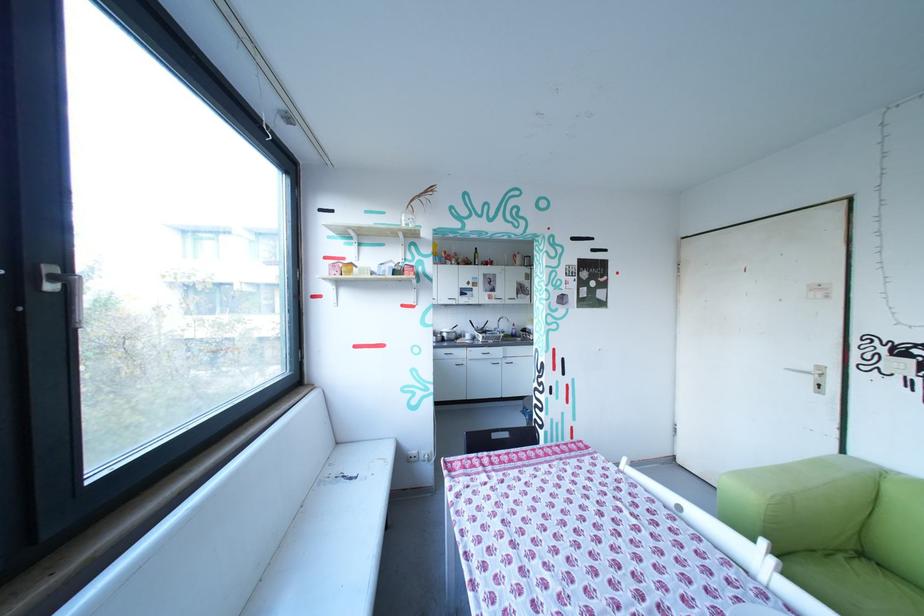
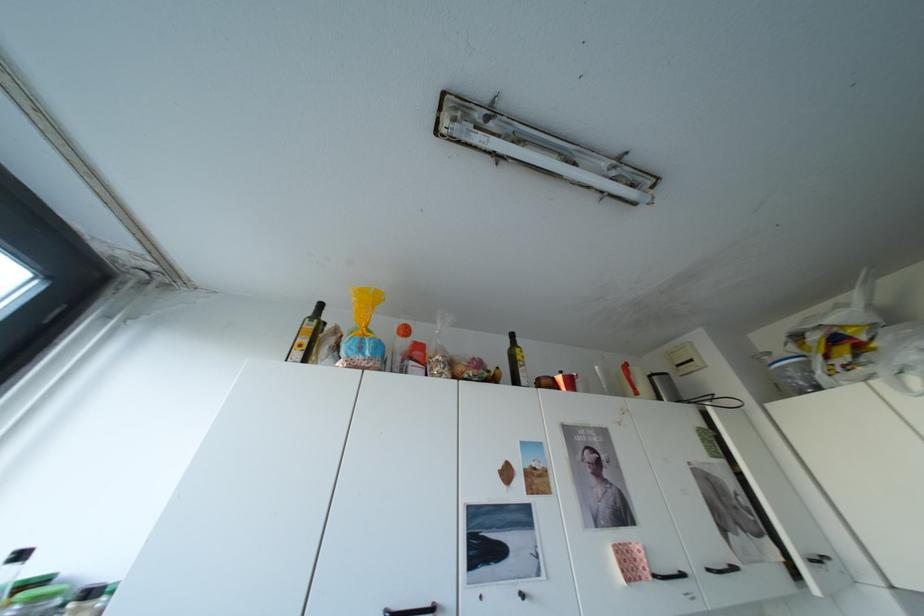
In the second image, find the point that corresponds to point 503,297 in the first image.

(642, 568)